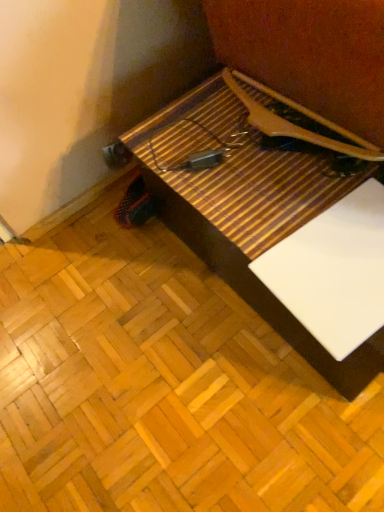
You are a GUI agent. You are given a task and a screenshot of the screen. Output one action in this format:
    pyautogui.click(x=<x>, y=<y>)
    Task: Click on the wooden table at center
    The image size is (384, 512).
    Given the screenshot: What is the action you would take?
    pyautogui.click(x=254, y=196)

This screenshot has width=384, height=512. What do you see at coordinates (254, 196) in the screenshot?
I see `wooden table at center` at bounding box center [254, 196].

This screenshot has width=384, height=512. What do you see at coordinates (333, 271) in the screenshot? I see `white matte paper at lower right` at bounding box center [333, 271].

At what (x,y) coordinates should I click in order to perform the action: click on white matte paper at lower right. Please return your answer as a coordinate pair (x, y). The height and width of the screenshot is (512, 384). Looking at the image, I should click on (333, 271).

At what (x,y) coordinates should I click in order to perform the action: click on wooden table at center. Please return your answer as a coordinate pair (x, y). This screenshot has height=512, width=384. Looking at the image, I should click on (254, 196).

Between white matte paper at lower right and wooden table at center, which one appears on the right side from the viewer's perspective?

From the viewer's perspective, white matte paper at lower right appears more on the right side.

Is white matte paper at lower right further to the viewer compared to wooden table at center?

That is True.

Considering the positions of point (313, 285) and point (249, 218), is point (313, 285) closer or farther from the camera than point (249, 218)?

Point (313, 285) is closer to the camera than point (249, 218).

From the image's perspective, which one is positioned higher, white matte paper at lower right or wooden table at center?

wooden table at center, from the image's perspective.

From a real-world perspective, which is physically above, white matte paper at lower right or wooden table at center?

white matte paper at lower right is physically above.

Looking at their sizes, would you say white matte paper at lower right is wider or thinner than wooden table at center?

Considering their sizes, white matte paper at lower right looks slimmer than wooden table at center.

Consider the image. Which of these two, white matte paper at lower right or wooden table at center, stands shorter?

With less height is white matte paper at lower right.

Considering the sizes of objects white matte paper at lower right and wooden table at center in the image provided, who is smaller, white matte paper at lower right or wooden table at center?

With smaller size is white matte paper at lower right.

Is white matte paper at lower right completely or partially outside of wooden table at center?

No, white matte paper at lower right is inside wooden table at center's boundary.

Would you consider white matte paper at lower right to be distant from wooden table at center?

No.

Is white matte paper at lower right facing towards wooden table at center?

Yes, white matte paper at lower right is facing wooden table at center.

How many degrees apart are the facing directions of white matte paper at lower right and wooden table at center?

Result: white matte paper at lower right and wooden table at center are facing 3.31 degrees away from each other.

Identify the location of table above the white matte paper at lower right (from the image's perspective). (254, 196).

Between wooden table at center and white matte paper at lower right, which one appears on the right side from the viewer's perspective?

white matte paper at lower right is more to the right.

Looking at this image, which is in front, wooden table at center or white matte paper at lower right?

wooden table at center is in front.

Is point (340, 185) closer or farther from the camera than point (356, 254)?

Point (340, 185) is positioned farther from the camera compared to point (356, 254).

From the image's perspective, which one is positioned lower, wooden table at center or white matte paper at lower right?

white matte paper at lower right.

From a real-world perspective, which object stands above the other?

white matte paper at lower right, from a real-world perspective.

Which object is wider, wooden table at center or white matte paper at lower right?

wooden table at center.

Can you confirm if wooden table at center is shorter than white matte paper at lower right?

In fact, wooden table at center may be taller than white matte paper at lower right.

Consider the image. Does wooden table at center have a larger size compared to white matte paper at lower right?

Yes, wooden table at center is bigger than white matte paper at lower right.

Would you say wooden table at center contains white matte paper at lower right?

Yes, wooden table at center contains white matte paper at lower right.

Is wooden table at center next to white matte paper at lower right?

There is a gap between wooden table at center and white matte paper at lower right.

Is wooden table at center turned away from white matte paper at lower right?

That's not correct — wooden table at center is not looking away from white matte paper at lower right.

Find the location of a particular element. wide behind the wooden table at center is located at coordinates (333, 271).

Identify the location of table that is on the left side of white matte paper at lower right. This screenshot has width=384, height=512. (254, 196).

Locate an element on the screen. The image size is (384, 512). table that is under the white matte paper at lower right (from a real-world perspective) is located at coordinates (254, 196).